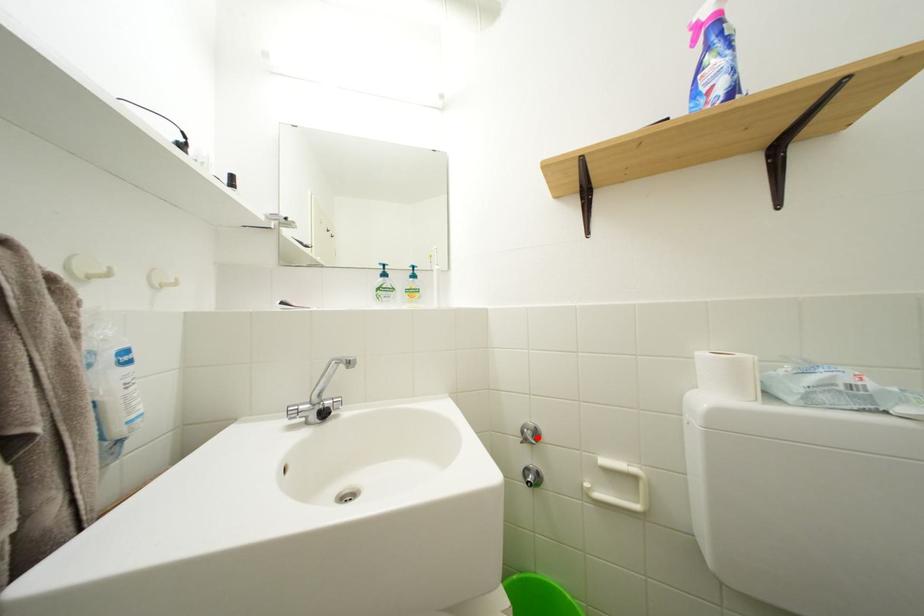
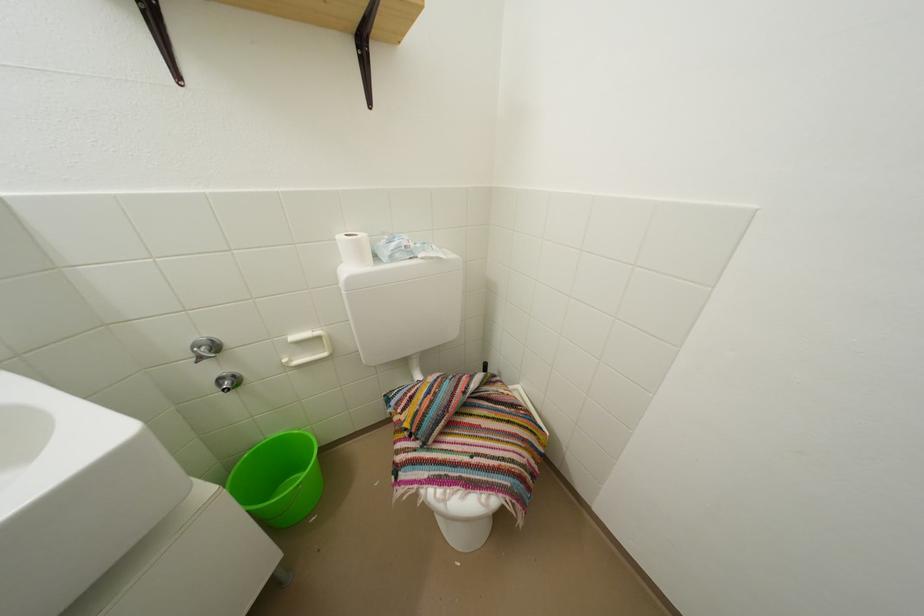
The point at the highlighted location is marked in the first image. Where is the corresponding point in the second image?

(213, 354)